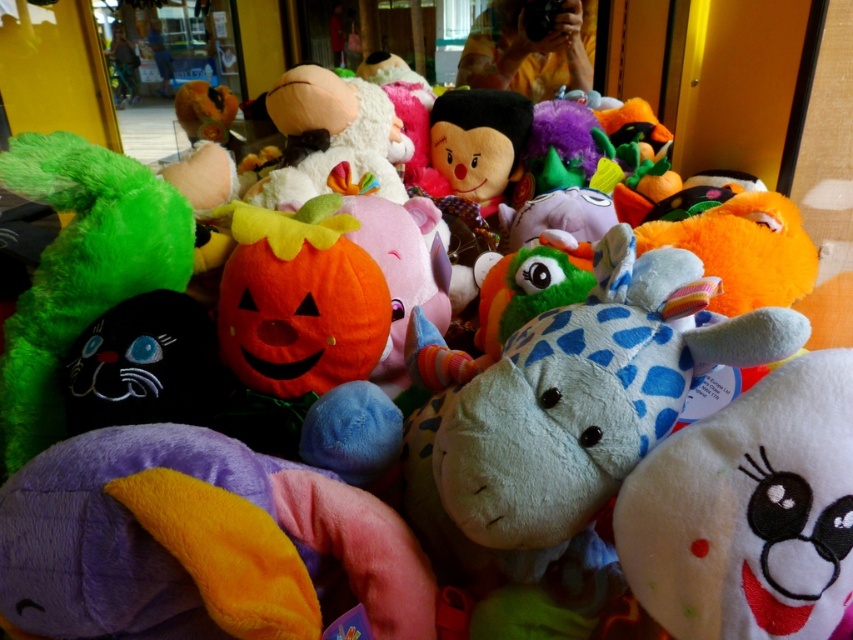
From the picture: You are organizing a toy store shelf and need to place the white soft plush at center and the fluffy plush pumpkin at center. Given their sizes, which one should you place first to maximize shelf space efficiency?

The white soft plush at center occupies less space than the fluffy plush pumpkin at center, so you should place the fluffy plush pumpkin at center first to make better use of the available space.

You are standing in front of the vibrant collection of plush toys. There are two points marked in the scene. The first point is at coordinates point (647, 538), and the second point is at coordinates point (347, 109). If you were to walk from the first point to the second point, would you be moving towards or away from the pumpkin plush toy?

Point (647, 538) is in front of point (347, 109). Therefore, moving from the first point to the second point would mean moving away from the pumpkin plush toy.

You are organizing a Halloween display and need to place the white soft plush at center and the fluffy plush pumpkin at center in a specific arrangement. According to the scene, which of these two plush toys is located to the right of the other?

The white soft plush at center is positioned on the right side of the fluffy plush pumpkin at center, so the white soft plush at center is to the right of the fluffy plush pumpkin at center.